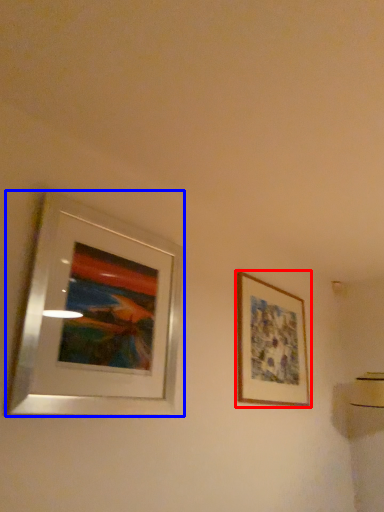
Question: Which object is further to the camera taking this photo, picture frame (highlighted by a red box) or picture frame (highlighted by a blue box)?

Choices:
 (A) picture frame
 (B) picture frame

Answer: (A)